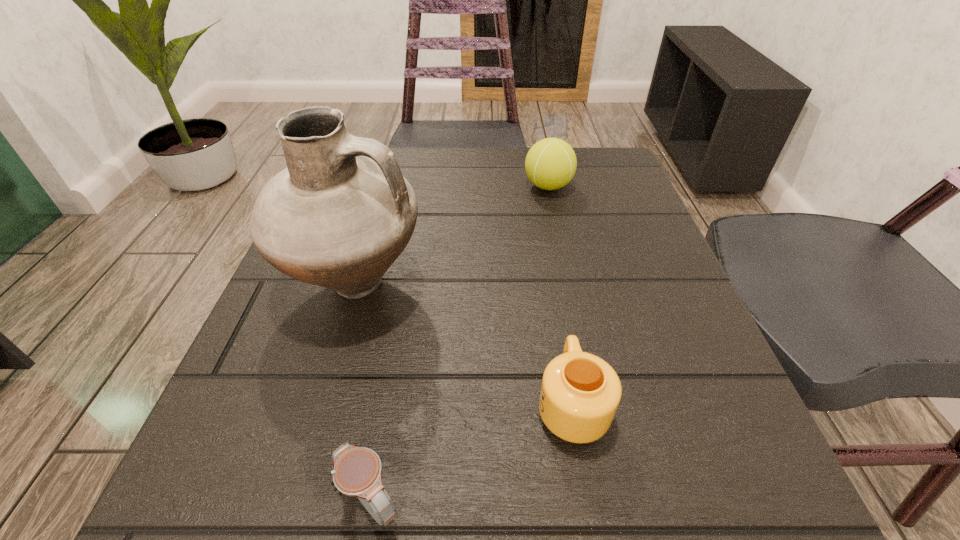
This screenshot has width=960, height=540. What are the coordinates of `vacant space that satisfies the following two spatial constraints: 1. on the back side of the watch; 2. on the handle side of the tallest object` in the screenshot? It's located at (408, 286).

Where is `vacant region that satisfies the following two spatial constraints: 1. on the back side of the nearest object; 2. on the handle side of the third nearest object`? The height and width of the screenshot is (540, 960). vacant region that satisfies the following two spatial constraints: 1. on the back side of the nearest object; 2. on the handle side of the third nearest object is located at coordinates (408, 286).

At what (x,y) coordinates should I click in order to perform the action: click on free region that satisfies the following two spatial constraints: 1. on the back side of the nearest object; 2. on the right side of the second tallest object. Please return your answer as a coordinate pair (x, y). Looking at the image, I should click on (425, 186).